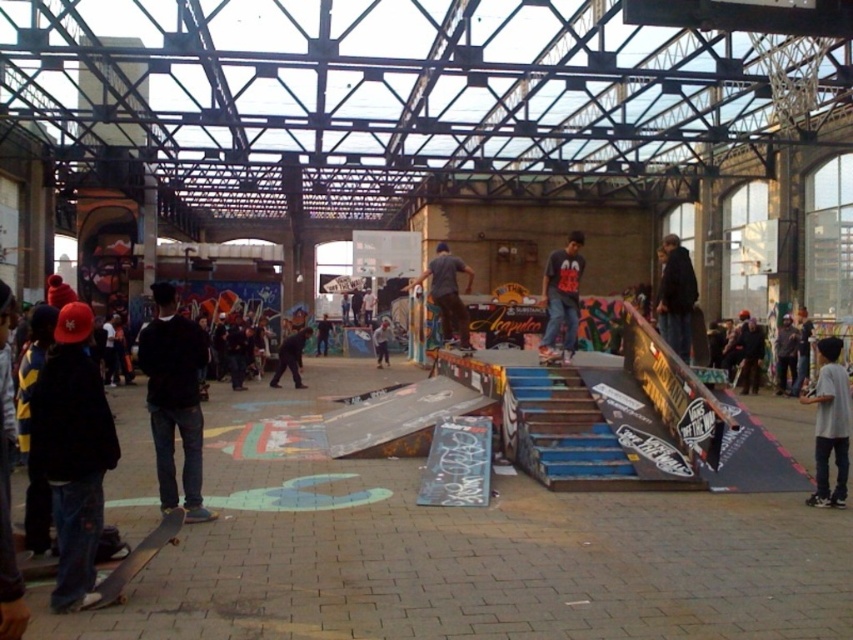
You are a skateboarder who just arrived at the indoor skatepark. You see the black matte jacket at center. Where would you look to find it?

The black matte jacket at center is located at point 0.623 on the x axis and 0.205 on the y axis.